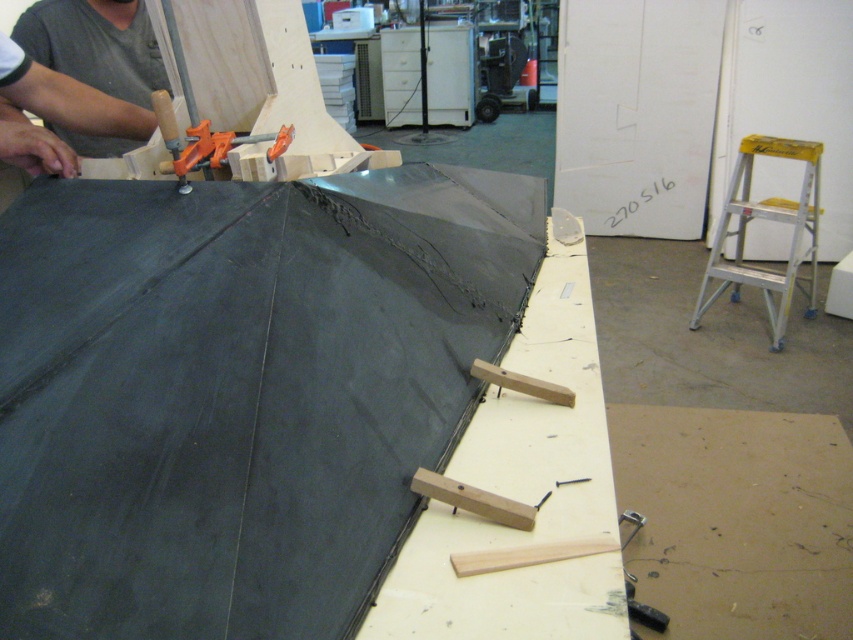
Question: Is brown matte plywood at lower right to the right of gray fabric at upper left from the viewer's perspective?

Choices:
 (A) no
 (B) yes

Answer: (B)

Question: Does brown matte plywood at lower right appear under yellow aluminum stool at right?

Choices:
 (A) yes
 (B) no

Answer: (A)

Question: Can you confirm if brown matte plywood at lower right is positioned below yellow aluminum stool at right?

Choices:
 (A) no
 (B) yes

Answer: (B)

Question: Estimate the real-world distances between objects in this image. Which object is closer to the yellow aluminum stool at right?

Choices:
 (A) brown matte plywood at lower right
 (B) gray fabric at upper left

Answer: (A)

Question: Which point is closer to the camera?

Choices:
 (A) (798, 429)
 (B) (59, 131)

Answer: (B)

Question: Which point appears farthest from the camera in this image?

Choices:
 (A) (811, 262)
 (B) (741, 445)
 (C) (103, 147)

Answer: (A)